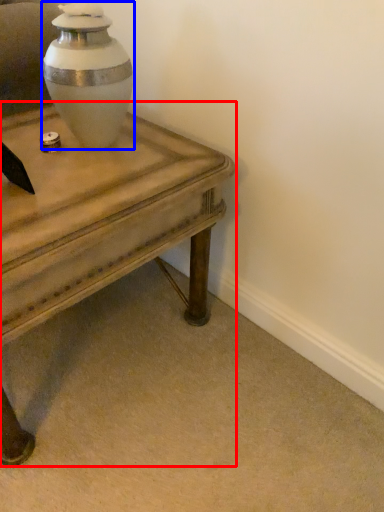
Question: Which object appears farthest to the camera in this image, table (highlighted by a red box) or vase (highlighted by a blue box)?

Choices:
 (A) table
 (B) vase

Answer: (B)